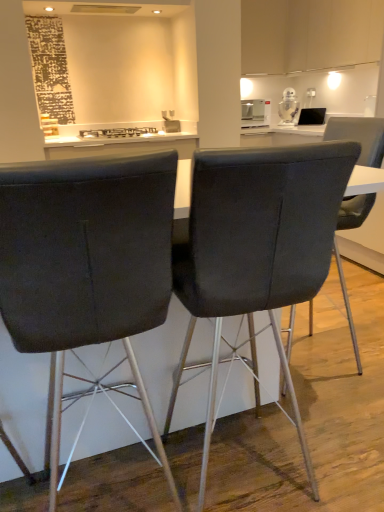
What is the approximate width of matte black chair at center, the 2th chair in the left-to-right sequence?

matte black chair at center, the 2th chair in the left-to-right sequence, is 20.39 inches in width.

The image size is (384, 512). What do you see at coordinates (255, 113) in the screenshot?
I see `satin silver toaster at upper center, marked as the 1th appliance in a left-to-right arrangement` at bounding box center [255, 113].

Find the location of a particular element. This screenshot has width=384, height=512. black glass stove at center is located at coordinates (118, 132).

Identify the location of velvet dark gray chair at center, which ranks as the first chair in right-to-left order. The height and width of the screenshot is (512, 384). (359, 136).

How much space does matte black chair at center, positioned as the 1th chair in left-to-right order, occupy vertically?

The height of matte black chair at center, positioned as the 1th chair in left-to-right order, is 1.10 meters.

Where is `matte black chair at center, arranged as the 3th chair when viewed from the right`? This screenshot has width=384, height=512. matte black chair at center, arranged as the 3th chair when viewed from the right is located at coordinates (87, 262).

This screenshot has width=384, height=512. Find the location of `matte black chair at center, the 2th chair in the left-to-right sequence`. matte black chair at center, the 2th chair in the left-to-right sequence is located at coordinates (259, 243).

Does matte black chair at center, positioned as the 1th chair in left-to-right order, have a smaller size compared to satin silver toaster at upper center, marked as the 1th appliance in a left-to-right arrangement?

Incorrect, matte black chair at center, positioned as the 1th chair in left-to-right order, is not smaller in size than satin silver toaster at upper center, marked as the 1th appliance in a left-to-right arrangement.

Which is more to the left, matte black chair at center, positioned as the 1th chair in left-to-right order, or satin silver toaster at upper center, acting as the second appliance starting from the right?

Positioned to the left is matte black chair at center, positioned as the 1th chair in left-to-right order.

From the image's perspective, is matte black chair at center, positioned as the 1th chair in left-to-right order, under satin silver toaster at upper center, acting as the second appliance starting from the right?

Correct, matte black chair at center, positioned as the 1th chair in left-to-right order, appears lower than satin silver toaster at upper center, acting as the second appliance starting from the right, in the image.

Identify the location of the 1st appliance positioned above the matte black chair at center, arranged as the 3th chair when viewed from the right (from a real-world perspective). (255, 113).

Are matte black chair at center, positioned as the 1th chair in left-to-right order, and matte black chair at center, the 2th chair in the left-to-right sequence, located far from each other?

No, matte black chair at center, positioned as the 1th chair in left-to-right order, is in close proximity to matte black chair at center, the 2th chair in the left-to-right sequence.

Between matte black chair at center, arranged as the 3th chair when viewed from the right, and matte black chair at center, the 2th chair in the left-to-right sequence, which one is positioned in front?

Positioned in front is matte black chair at center, arranged as the 3th chair when viewed from the right.

Based on their sizes in the image, would you say matte black chair at center, arranged as the 3th chair when viewed from the right, is bigger or smaller than matte black chair at center, which is the second chair in right-to-left order?

Clearly, matte black chair at center, arranged as the 3th chair when viewed from the right, is smaller in size than matte black chair at center, which is the second chair in right-to-left order.

The height and width of the screenshot is (512, 384). Identify the location of the 2nd appliance directly above the matte black chair at center, which is the second chair in right-to-left order (from a real-world perspective). (288, 106).

Does point (288, 110) lie behind point (256, 169)?

Yes.

Is white glossy robot at upper right, the 1th appliance when ordered from right to left, in front of or behind matte black chair at center, the 2th chair in the left-to-right sequence, in the image?

white glossy robot at upper right, the 1th appliance when ordered from right to left, is positioned farther from the viewer than matte black chair at center, the 2th chair in the left-to-right sequence.

Visually, is white glossy robot at upper right, arranged as the 2th appliance when viewed from the left, positioned to the left or to the right of matte black chair at center, which is the second chair in right-to-left order?

white glossy robot at upper right, arranged as the 2th appliance when viewed from the left, is positioned on matte black chair at center, which is the second chair in right-to-left order,'s right side.

Considering the positions of objects white glossy robot at upper right, the 1th appliance when ordered from right to left, and satin silver toaster at upper center, acting as the second appliance starting from the right, in the image provided, who is more to the left, white glossy robot at upper right, the 1th appliance when ordered from right to left, or satin silver toaster at upper center, acting as the second appliance starting from the right,?

satin silver toaster at upper center, acting as the second appliance starting from the right.

Is white glossy robot at upper right, the 1th appliance when ordered from right to left, behind satin silver toaster at upper center, marked as the 1th appliance in a left-to-right arrangement?

Yes, white glossy robot at upper right, the 1th appliance when ordered from right to left, is further from the camera.

Find the location of a particular element. The height and width of the screenshot is (512, 384). appliance above the satin silver toaster at upper center, acting as the second appliance starting from the right (from the image's perspective) is located at coordinates (288, 106).

Could you tell me if matte black chair at center, the 2th chair in the left-to-right sequence, is facing matte black chair at center, arranged as the 3th chair when viewed from the right?

No, matte black chair at center, the 2th chair in the left-to-right sequence, does not turn towards matte black chair at center, arranged as the 3th chair when viewed from the right.

Considering the sizes of objects matte black chair at center, the 2th chair in the left-to-right sequence, and matte black chair at center, positioned as the 1th chair in left-to-right order, in the image provided, who is wider, matte black chair at center, the 2th chair in the left-to-right sequence, or matte black chair at center, positioned as the 1th chair in left-to-right order,?

With larger width is matte black chair at center, positioned as the 1th chair in left-to-right order.

In the scene shown: Considering the sizes of objects matte black chair at center, the 2th chair in the left-to-right sequence, and matte black chair at center, arranged as the 3th chair when viewed from the right, in the image provided, who is shorter, matte black chair at center, the 2th chair in the left-to-right sequence, or matte black chair at center, arranged as the 3th chair when viewed from the right,?

Standing shorter between the two is matte black chair at center, the 2th chair in the left-to-right sequence.

From the image's perspective, is matte black chair at center, the 2th chair in the left-to-right sequence, over black glass stove at center?

No, from the image's perspective, matte black chair at center, the 2th chair in the left-to-right sequence, is not on top of black glass stove at center.

Which point is more forward, (212, 217) or (94, 130)?

The point (212, 217) is closer to the camera.

What's the angular difference between matte black chair at center, the 2th chair in the left-to-right sequence, and black glass stove at center's facing directions?

178 degrees separate the facing orientations of matte black chair at center, the 2th chair in the left-to-right sequence, and black glass stove at center.

Is velvet dark gray chair at center, placed as the third chair when sorted from left to right, inside matte black chair at center, which is the second chair in right-to-left order?

That's incorrect, velvet dark gray chair at center, placed as the third chair when sorted from left to right, is not inside matte black chair at center, which is the second chair in right-to-left order.

From the image's perspective, is matte black chair at center, which is the second chair in right-to-left order, over velvet dark gray chair at center, which ranks as the first chair in right-to-left order?

No.

Can you tell me how much matte black chair at center, which is the second chair in right-to-left order, and velvet dark gray chair at center, placed as the third chair when sorted from left to right, differ in facing direction?

90.8 degrees separate the facing orientations of matte black chair at center, which is the second chair in right-to-left order, and velvet dark gray chair at center, placed as the third chair when sorted from left to right.

Identify the location of the 3rd chair below when counting from the satin silver toaster at upper center, marked as the 1th appliance in a left-to-right arrangement (from the image's perspective). The width and height of the screenshot is (384, 512). (87, 262).

At what (x,y) coordinates should I click in order to perform the action: click on chair to the left of matte black chair at center, which is the second chair in right-to-left order. Please return your answer as a coordinate pair (x, y). The width and height of the screenshot is (384, 512). Looking at the image, I should click on (87, 262).

When comparing their distances from matte black chair at center, which is the second chair in right-to-left order, does white glossy robot at upper right, arranged as the 2th appliance when viewed from the left, or black glass stove at center seem closer?

Among the two, black glass stove at center is located nearer to matte black chair at center, which is the second chair in right-to-left order.

From the image, which object appears to be farther from matte black chair at center, positioned as the 1th chair in left-to-right order, black glass stove at center or white glossy robot at upper right, arranged as the 2th appliance when viewed from the left?

The object further to matte black chair at center, positioned as the 1th chair in left-to-right order, is white glossy robot at upper right, arranged as the 2th appliance when viewed from the left.

Estimate the real-world distances between objects in this image. Which object is further from matte black chair at center, the 2th chair in the left-to-right sequence, satin silver toaster at upper center, acting as the second appliance starting from the right, or velvet dark gray chair at center, which ranks as the first chair in right-to-left order?

The object further to matte black chair at center, the 2th chair in the left-to-right sequence, is satin silver toaster at upper center, acting as the second appliance starting from the right.

Considering their positions, is satin silver toaster at upper center, marked as the 1th appliance in a left-to-right arrangement, positioned closer to white glossy robot at upper right, the 1th appliance when ordered from right to left, than black glass stove at center?

satin silver toaster at upper center, marked as the 1th appliance in a left-to-right arrangement.

Looking at the image, which one is located further to white glossy robot at upper right, arranged as the 2th appliance when viewed from the left, black glass stove at center or velvet dark gray chair at center, placed as the third chair when sorted from left to right?

Among the two, velvet dark gray chair at center, placed as the third chair when sorted from left to right, is located further to white glossy robot at upper right, arranged as the 2th appliance when viewed from the left.

Considering their positions, is matte black chair at center, the 2th chair in the left-to-right sequence, positioned further to matte black chair at center, arranged as the 3th chair when viewed from the right, than white glossy robot at upper right, arranged as the 2th appliance when viewed from the left?

The object further to matte black chair at center, arranged as the 3th chair when viewed from the right, is white glossy robot at upper right, arranged as the 2th appliance when viewed from the left.

Considering their positions, is velvet dark gray chair at center, which ranks as the first chair in right-to-left order, positioned closer to black glass stove at center than satin silver toaster at upper center, acting as the second appliance starting from the right?

Based on the image, satin silver toaster at upper center, acting as the second appliance starting from the right, appears to be nearer to black glass stove at center.

Which object lies further to the anchor point matte black chair at center, which is the second chair in right-to-left order, matte black chair at center, arranged as the 3th chair when viewed from the right, or satin silver toaster at upper center, acting as the second appliance starting from the right?

satin silver toaster at upper center, acting as the second appliance starting from the right, is further to matte black chair at center, which is the second chair in right-to-left order.

Locate an element on the screen. The height and width of the screenshot is (512, 384). stove between matte black chair at center, which is the second chair in right-to-left order, and satin silver toaster at upper center, marked as the 1th appliance in a left-to-right arrangement, in the front-back direction is located at coordinates (118, 132).

You are a GUI agent. You are given a task and a screenshot of the screen. Output one action in this format:
    pyautogui.click(x=<x>, y=<y>)
    Task: Click on the appliance located between matte black chair at center, arranged as the 3th chair when viewed from the right, and white glossy robot at upper right, arranged as the 2th appliance when viewed from the left, in the depth direction
    The height and width of the screenshot is (512, 384).
    Given the screenshot: What is the action you would take?
    pyautogui.click(x=255, y=113)

At what (x,y) coordinates should I click in order to perform the action: click on stove positioned between velvet dark gray chair at center, placed as the third chair when sorted from left to right, and satin silver toaster at upper center, acting as the second appliance starting from the right, from near to far. Please return your answer as a coordinate pair (x, y). The width and height of the screenshot is (384, 512). Looking at the image, I should click on (118, 132).

Locate an element on the screen. The image size is (384, 512). stove located between matte black chair at center, arranged as the 3th chair when viewed from the right, and satin silver toaster at upper center, acting as the second appliance starting from the right, in the depth direction is located at coordinates (118, 132).